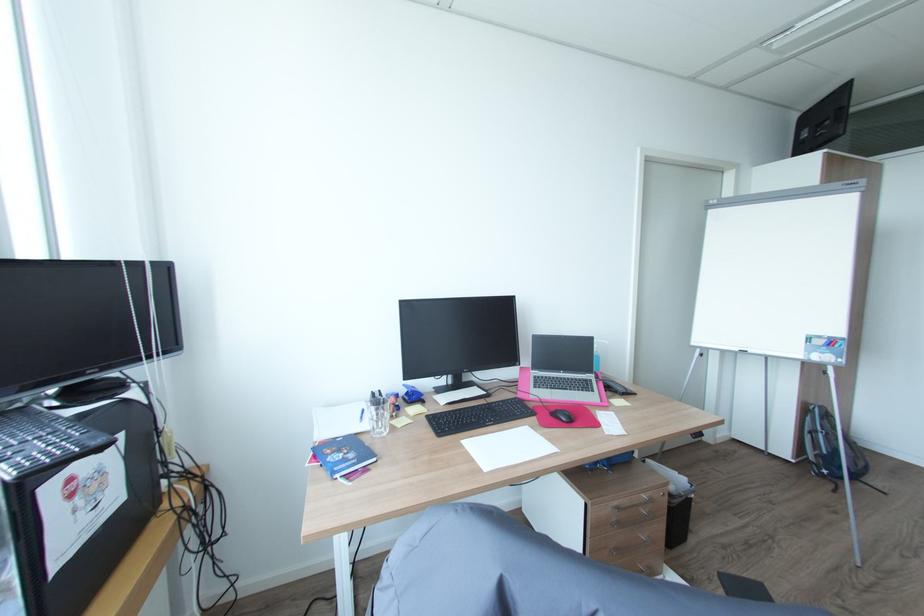
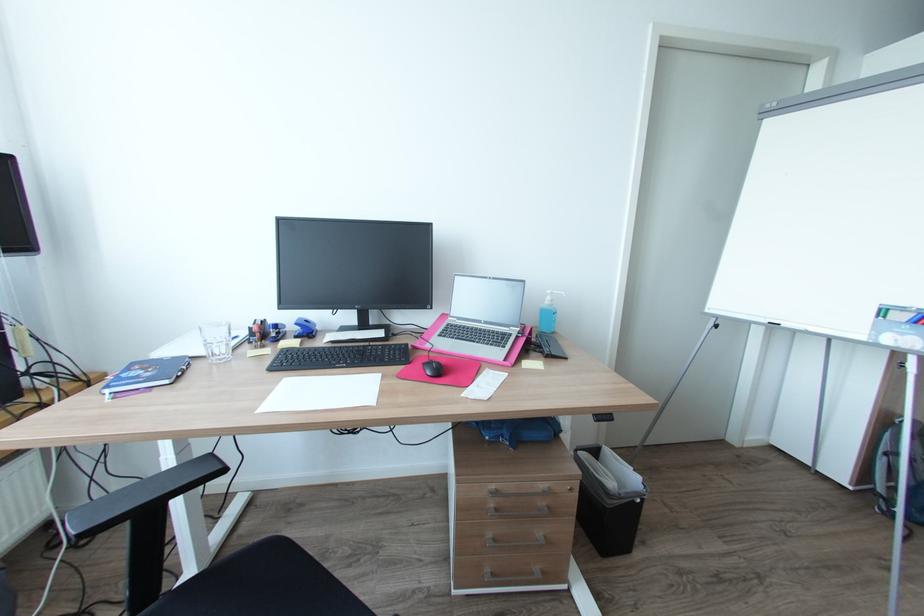
Locate, in the second image, the point that corresponds to (698,344) in the first image.

(712, 310)